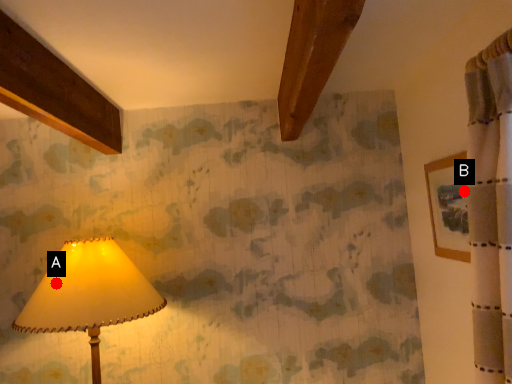
Question: Two points are circled on the image, labeled by A and B beside each circle. Which point is closer to the camera taking this photo?

Choices:
 (A) A is closer
 (B) B is closer

Answer: (B)